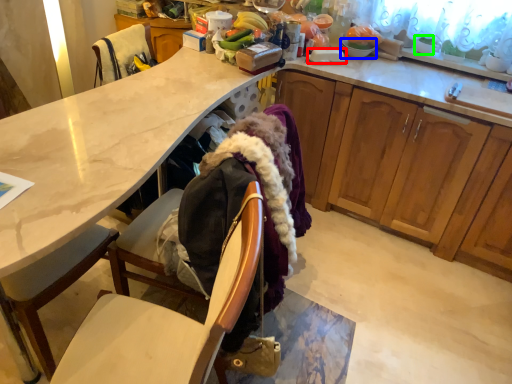
Question: Which is farther away from plate (highlighted by a red box)? tableware (highlighted by a blue box) or houseplant (highlighted by a green box)?

Choices:
 (A) tableware
 (B) houseplant

Answer: (B)